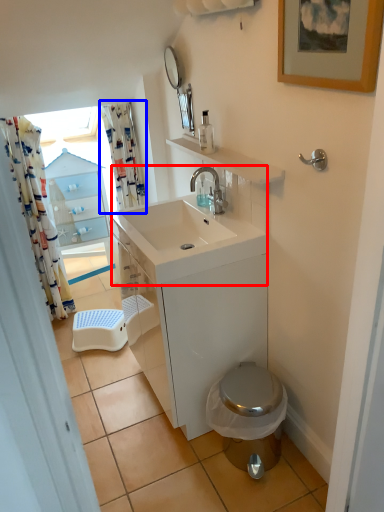
Question: Among these objects, which one is farthest to the camera, sink (highlighted by a red box) or shower curtain (highlighted by a blue box)?

Choices:
 (A) sink
 (B) shower curtain

Answer: (B)